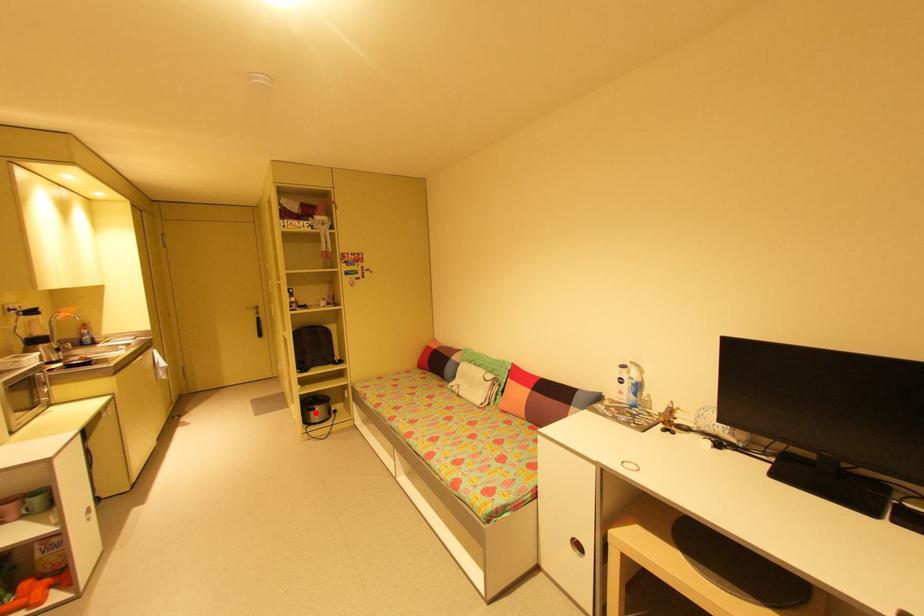
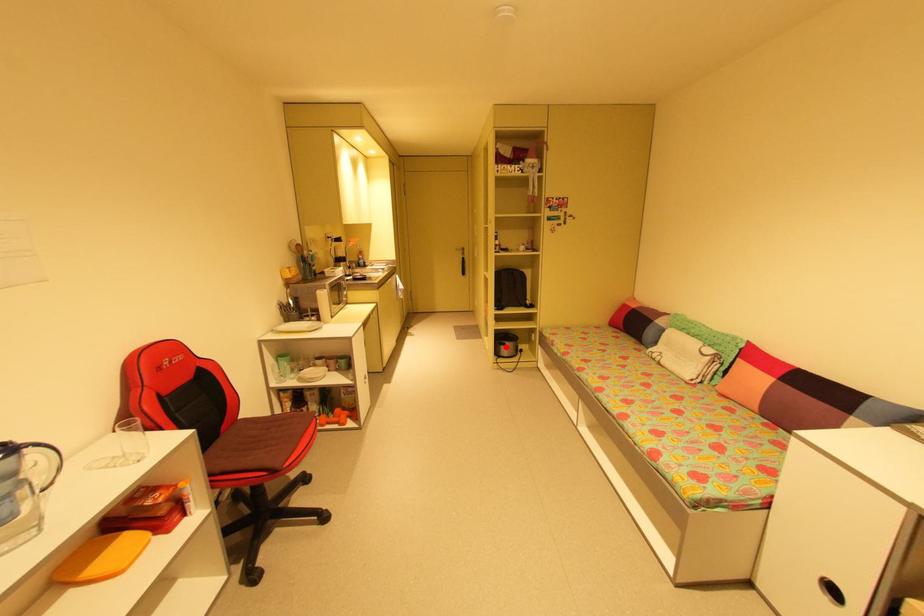
I am providing you with two images of the same scene from different viewpoints. A red point is marked on the first image and another point is marked on the second image. Does the point marked in image1 correspond to the same location as the one in image2?

Yes